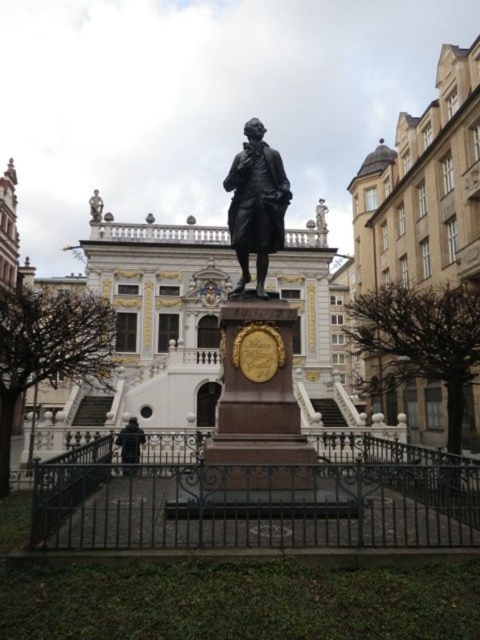
Who is taller, bronze statue at center or black fabric coat at center?

Standing taller between the two is bronze statue at center.

Consider the image. Is the position of bronze statue at center less distant than that of black fabric coat at center?

No.

Does point (230, 166) come closer to viewer compared to point (140, 448)?

No.

I want to click on bronze statue at center, so click(x=256, y=204).

Between brown stone palace at upper right and black fabric coat at center, which one is positioned lower?

black fabric coat at center is below.

Image resolution: width=480 pixels, height=640 pixels. In order to click on brown stone palace at upper right in this screenshot , I will do `click(423, 189)`.

Can you confirm if brown stone palace at upper right is shorter than bronze statue at center?

No, brown stone palace at upper right is not shorter than bronze statue at center.

Image resolution: width=480 pixels, height=640 pixels. Find the location of `brown stone palace at upper right`. brown stone palace at upper right is located at coordinates tap(423, 189).